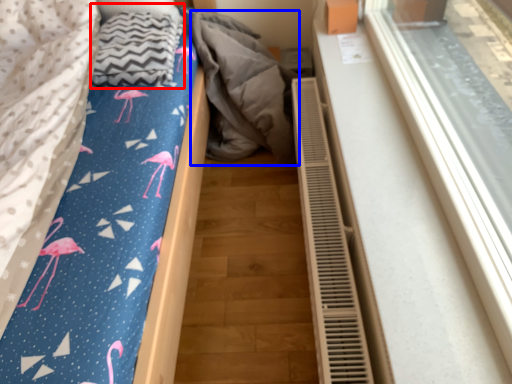
Question: Which of the following is the farthest to the observer, blanket (highlighted by a red box) or material (highlighted by a blue box)?

Choices:
 (A) blanket
 (B) material

Answer: (B)